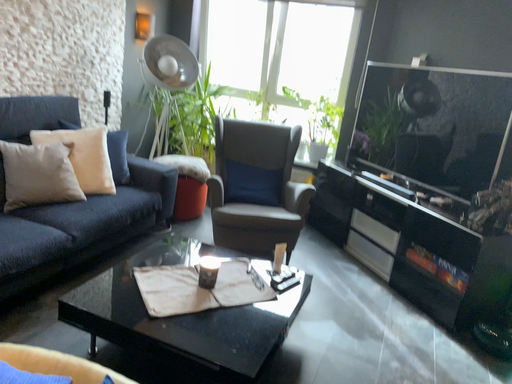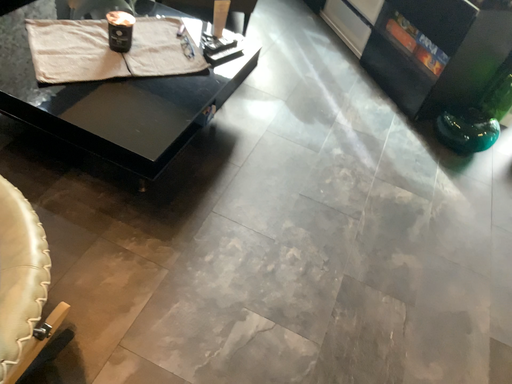
Question: Which way did the camera rotate in the video?

Choices:
 (A) rotated downward
 (B) rotated upward

Answer: (A)